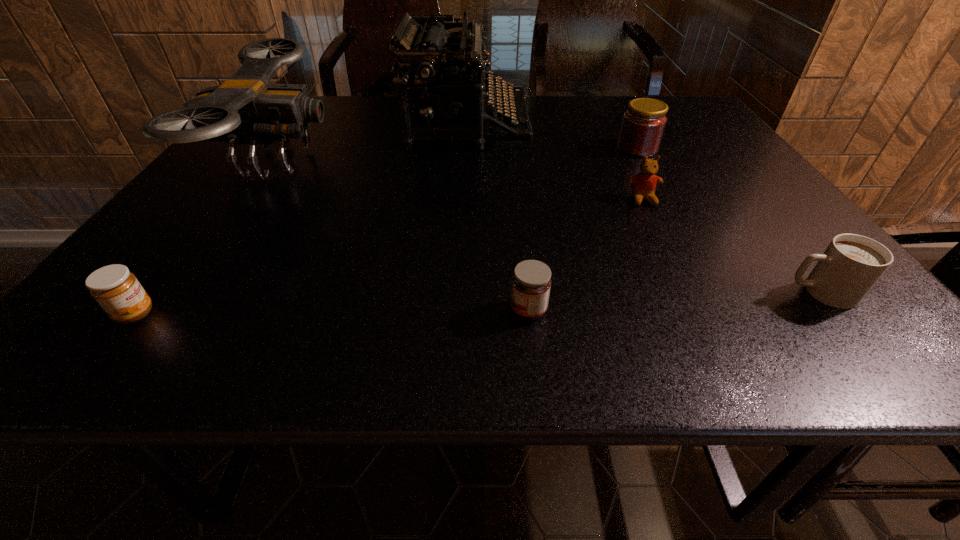
Identify the location of empty space between the second jam from right to left and the teddy bear. Image resolution: width=960 pixels, height=540 pixels. (586, 255).

Find the location of `blank region between the second jam from left to right and the drone`. blank region between the second jam from left to right and the drone is located at coordinates (402, 237).

Find the location of a particular element. The image size is (960, 540). vacant area that lies between the leftmost jam and the typewriter is located at coordinates (301, 219).

Where is `free point between the second jam from left to right and the typewriter`? The width and height of the screenshot is (960, 540). free point between the second jam from left to right and the typewriter is located at coordinates (498, 218).

Locate an element on the screen. The height and width of the screenshot is (540, 960). empty space between the drone and the second jam from right to left is located at coordinates (402, 237).

In order to click on vacant area that lies between the cappuccino and the tallest jam in this screenshot , I will do `click(729, 220)`.

You are a GUI agent. You are given a task and a screenshot of the screen. Output one action in this format:
    pyautogui.click(x=<x>, y=<y>)
    Task: Click on the free area in between the cappuccino and the teddy bear
    The height and width of the screenshot is (540, 960).
    Given the screenshot: What is the action you would take?
    pyautogui.click(x=731, y=246)

Find the location of a particular element. This screenshot has height=540, width=960. the fifth closest object to the farthest jam is located at coordinates (246, 109).

Find the location of a particular element. the fifth closest object to the teddy bear is located at coordinates (246, 109).

You are a GUI agent. You are given a task and a screenshot of the screen. Output one action in this format:
    pyautogui.click(x=<x>, y=<y>)
    Task: Click on the second closest jam to the farthest jam
    Image resolution: width=960 pixels, height=540 pixels.
    Given the screenshot: What is the action you would take?
    pyautogui.click(x=117, y=290)